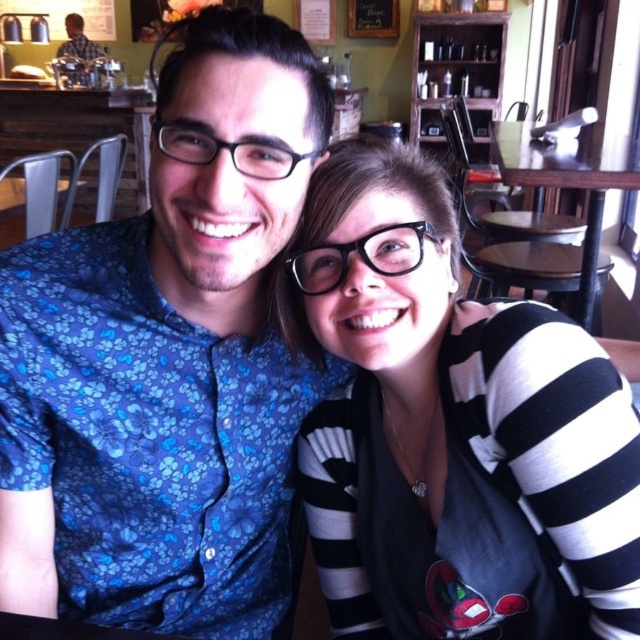
Does wooden table at right appear under brushed metal water at bottle left?

Yes.

From the picture: Measure the distance between point [557,163] and camera.

The distance of point [557,163] from camera is 1.72 meters.

Is point (520, 172) in front of point (67, 19)?

Yes.

Find the location of a particular element. The width and height of the screenshot is (640, 640). wooden table at right is located at coordinates (570, 180).

Image resolution: width=640 pixels, height=640 pixels. Describe the element at coordinates (451, 428) in the screenshot. I see `black and white striped sweater at center` at that location.

Is black and white striped sweater at center above brushed metal water at bottle left?

Incorrect, black and white striped sweater at center is not positioned above brushed metal water at bottle left.

Identify the location of black and white striped sweater at center. (451, 428).

Locate an element on the screen. This screenshot has width=640, height=640. black and white striped sweater at center is located at coordinates (451, 428).

Who is lower down, black and white striped sweater at center or wooden table at right?

black and white striped sweater at center

Between black and white striped sweater at center and wooden table at right, which one has less height?

black and white striped sweater at center is shorter.

Locate an element on the screen. The height and width of the screenshot is (640, 640). black and white striped sweater at center is located at coordinates (451, 428).

Find the location of a particular element. black and white striped sweater at center is located at coordinates (451, 428).